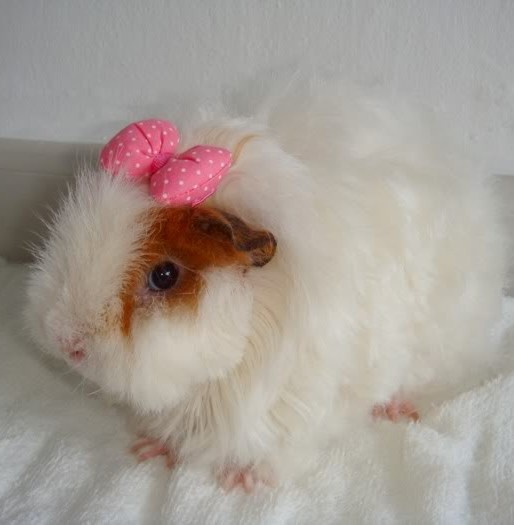
At what (x,y) coordinates should I click in order to perform the action: click on white wall. Please return your answer as a coordinate pair (x, y). Looking at the image, I should click on (220, 36).